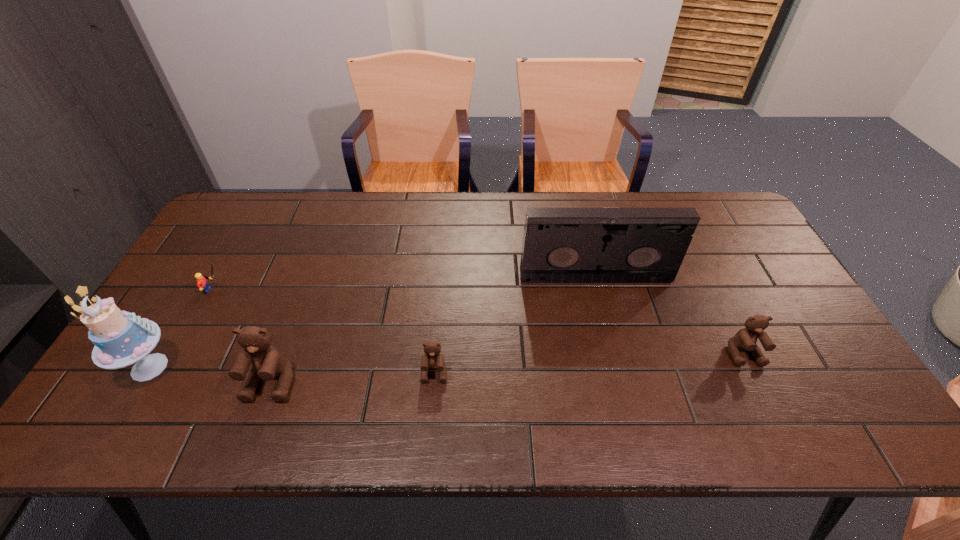
Locate an element on the screen. The width and height of the screenshot is (960, 540). vacant space positioned on the front-facing side of the second farthest object is located at coordinates (362, 290).

You are a GUI agent. You are given a task and a screenshot of the screen. Output one action in this format:
    pyautogui.click(x=<x>, y=<y>)
    Task: Click on the vacant area situated on the front side of the second object from right to left
    This screenshot has height=540, width=960.
    Given the screenshot: What is the action you would take?
    pyautogui.click(x=604, y=310)

Where is `vacant space located 0.140m with a ladder on the side of the cake`? The image size is (960, 540). vacant space located 0.140m with a ladder on the side of the cake is located at coordinates (234, 367).

Locate an element on the screen. The height and width of the screenshot is (540, 960). cake that is at the near edge is located at coordinates (121, 338).

The image size is (960, 540). Identify the location of Lego located in the left edge section of the desktop. (202, 283).

What are the coordinates of `cake located at the left edge` in the screenshot? It's located at (121, 338).

Image resolution: width=960 pixels, height=540 pixels. I want to click on object that is at the near left corner, so click(x=121, y=338).

I want to click on free region at the far edge, so click(x=330, y=222).

Where is `vacant space at the near edge of the desktop`? Image resolution: width=960 pixels, height=540 pixels. vacant space at the near edge of the desktop is located at coordinates (746, 394).

In the image, there is a desktop. Find the location of `free space at the right edge`. free space at the right edge is located at coordinates coord(741,251).